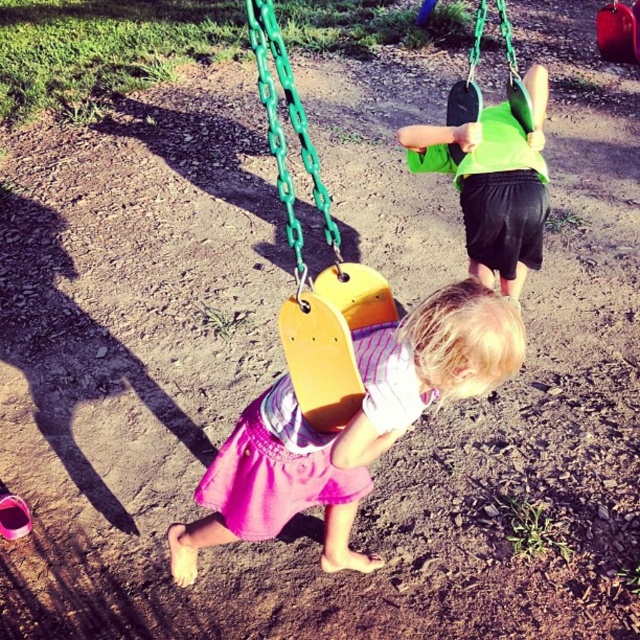
Between point (451, 381) and point (480, 124), which one is positioned in front?

Positioned in front is point (451, 381).

Between point (413, 333) and point (516, 156), which one is positioned behind?

The point (516, 156) is behind.

You are a GUI agent. You are given a task and a screenshot of the screen. Output one action in this format:
    pyautogui.click(x=<x>, y=<y>)
    Task: Click on the pink fabric skirt at center
    
    Given the screenshot: What is the action you would take?
    pyautogui.click(x=348, y=426)